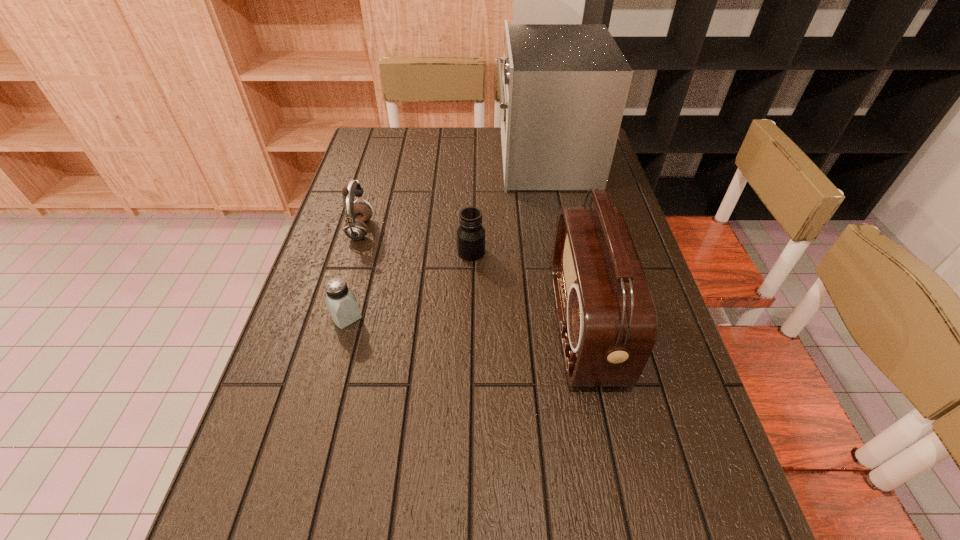
Where is `the tallest object`? the tallest object is located at coordinates (564, 87).

Find the location of a particular element. This screenshot has height=540, width=960. the farthest object is located at coordinates (564, 87).

The width and height of the screenshot is (960, 540). Find the location of `radio receiver`. radio receiver is located at coordinates (607, 319).

Find the location of a particular element. The height and width of the screenshot is (540, 960). earphone is located at coordinates (356, 214).

Locate an element on the screen. Image resolution: width=960 pixels, height=540 pixels. the third object from left to right is located at coordinates (470, 234).

Where is `the shortest object`? the shortest object is located at coordinates (341, 302).

Where is `free location located on the front panel of the toaster oven`? The image size is (960, 540). free location located on the front panel of the toaster oven is located at coordinates (407, 160).

Locate an element on the screen. vacant point located on the front panel of the toaster oven is located at coordinates (445, 160).

Where is `free space located 0.260m on the front panel of the toaster oven`? Image resolution: width=960 pixels, height=540 pixels. free space located 0.260m on the front panel of the toaster oven is located at coordinates (419, 160).

I want to click on vacant space situated on the front panel of the radio receiver, so click(x=443, y=327).